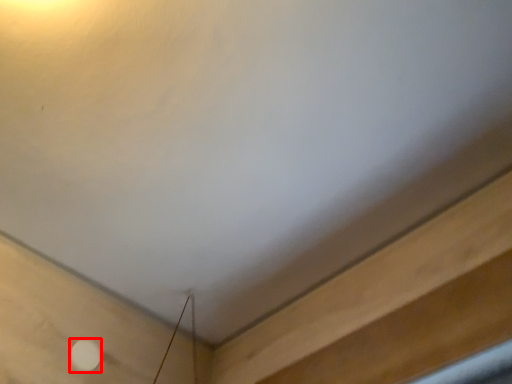
Question: From the image's perspective, where is dot (annotated by the red box) located relative to plywood?

Choices:
 (A) below
 (B) above

Answer: (A)